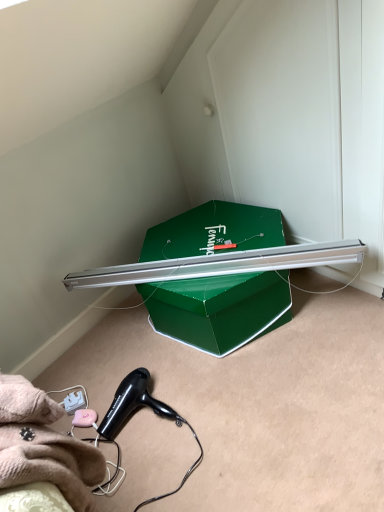
I want to click on free location in front of black plastic hair dryer at lower left, so click(175, 472).